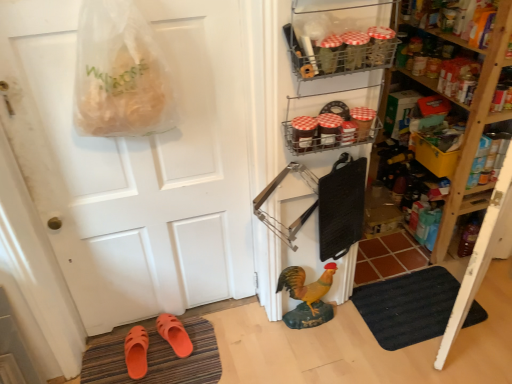
The image size is (512, 384). Find the location of `free location in front of orange rubber slippers at lower left, which is the second footwear from left to right`. free location in front of orange rubber slippers at lower left, which is the second footwear from left to right is located at coordinates (177, 371).